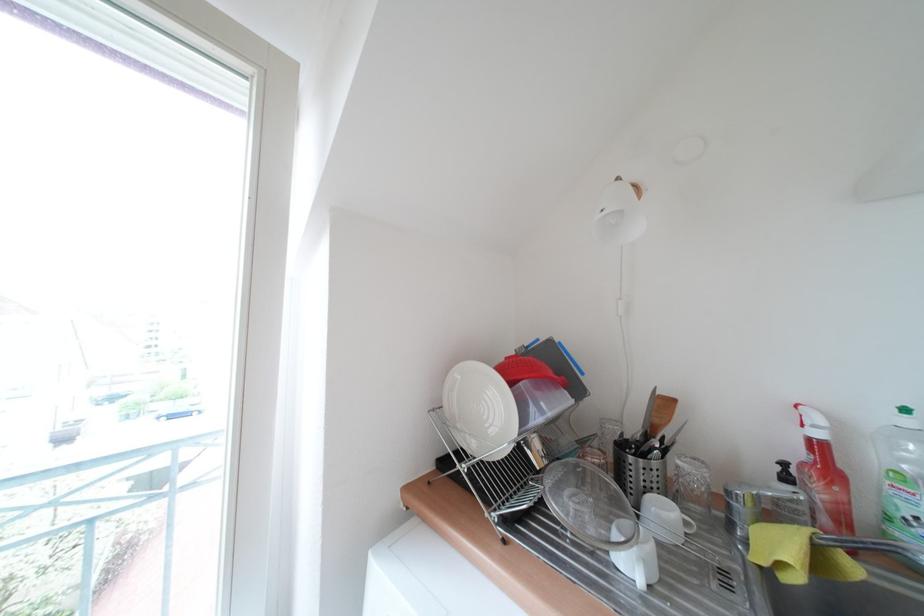
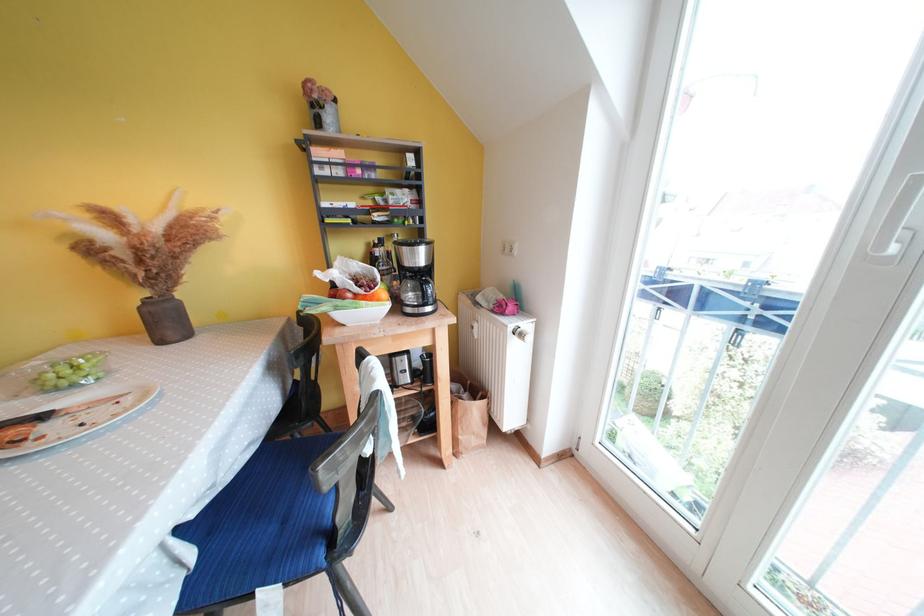
The first image is from the beginning of the video and the second image is from the end. How did the camera likely rotate when shooting the video?

The camera rotated toward left-down.